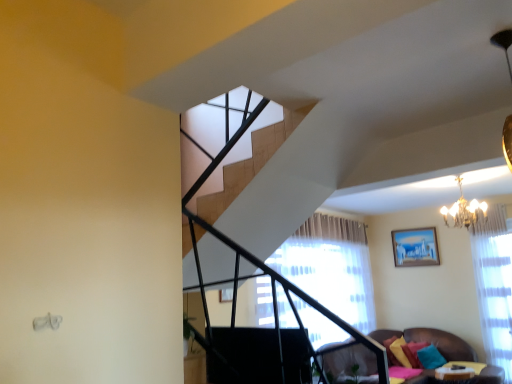
At what (x,y) coordinates should I click in order to perform the action: click on wooden table at lower right. Please return your answer as a coordinate pair (x, y). Image resolution: width=512 pixels, height=384 pixels. Looking at the image, I should click on (479, 373).

Identify the location of teal fabric pillow at lower right, which appears as the second pillow when viewed from the left. (411, 353).

What do you see at coordinates (400, 352) in the screenshot? The image size is (512, 384). I see `velvet yellow pillow at lower right, acting as the first pillow starting from the left` at bounding box center [400, 352].

Locate an element on the screen. This screenshot has height=384, width=512. matte blue painting at upper right is located at coordinates (415, 247).

Where is `wooden table at lower right`? The image size is (512, 384). wooden table at lower right is located at coordinates (x=479, y=373).

Is point (440, 355) behind point (393, 349)?

Yes, it is behind point (393, 349).

Which object is thinner, teal fabric pillow at lower right, which appears as the second pillow when viewed from the left, or velvet yellow pillow at lower right, which appears as the third pillow when viewed from the right?

With smaller width is teal fabric pillow at lower right, which appears as the second pillow when viewed from the left.

Identify the location of pillow that is the 2nd one when counting downward from the teal fabric pillow at lower right, the 2th pillow in the right-to-left sequence (from the image's perspective). (400, 352).

Which object is further away from the camera taking this photo, teal fabric pillow at lower right, the 2th pillow in the right-to-left sequence, or velvet yellow pillow at lower right, acting as the first pillow starting from the left?

velvet yellow pillow at lower right, acting as the first pillow starting from the left, is further from the camera.

Considering the sizes of objects teal fabric pillow at lower right, which is counted as the third pillow, starting from the left, and matte blue painting at upper right in the image provided, who is shorter, teal fabric pillow at lower right, which is counted as the third pillow, starting from the left, or matte blue painting at upper right?

teal fabric pillow at lower right, which is counted as the third pillow, starting from the left.

Can you tell me how much teal fabric pillow at lower right, arranged as the 1th pillow when viewed from the right, and matte blue painting at upper right differ in facing direction?

The facing directions of teal fabric pillow at lower right, arranged as the 1th pillow when viewed from the right, and matte blue painting at upper right are 61 degrees apart.

From a real-world perspective, which is physically below, teal fabric pillow at lower right, arranged as the 1th pillow when viewed from the right, or matte blue painting at upper right?

teal fabric pillow at lower right, arranged as the 1th pillow when viewed from the right, is physically lower.

From the picture: Is teal fabric pillow at lower right, arranged as the 1th pillow when viewed from the right, to the left or to the right of matte blue painting at upper right in the image?

In the image, teal fabric pillow at lower right, arranged as the 1th pillow when viewed from the right, appears on the left side of matte blue painting at upper right.

Is velvet brown couch at lower right positioned in front of gold crystal chandelier at upper right?

Yes, velvet brown couch at lower right is closer to the viewer.

From a real-world perspective, is velvet brown couch at lower right above or below gold crystal chandelier at upper right?

velvet brown couch at lower right is situated lower than gold crystal chandelier at upper right in the real world.

Considering the sizes of velvet brown couch at lower right and gold crystal chandelier at upper right in the image, is velvet brown couch at lower right bigger or smaller than gold crystal chandelier at upper right?

Considering their sizes, velvet brown couch at lower right takes up more space than gold crystal chandelier at upper right.

How many degrees apart are the facing directions of velvet brown couch at lower right and gold crystal chandelier at upper right?

90 degrees separate the facing orientations of velvet brown couch at lower right and gold crystal chandelier at upper right.

Are teal fabric pillow at lower right, arranged as the 1th pillow when viewed from the right, and wooden table at lower right far apart?

teal fabric pillow at lower right, arranged as the 1th pillow when viewed from the right, is near wooden table at lower right, not far away.

From a real-world perspective, is teal fabric pillow at lower right, arranged as the 1th pillow when viewed from the right, located beneath wooden table at lower right?

No.

Considering the sizes of objects teal fabric pillow at lower right, which is counted as the third pillow, starting from the left, and wooden table at lower right in the image provided, who is taller, teal fabric pillow at lower right, which is counted as the third pillow, starting from the left, or wooden table at lower right?

Standing taller between the two is teal fabric pillow at lower right, which is counted as the third pillow, starting from the left.

Considering the relative sizes of teal fabric pillow at lower right, arranged as the 1th pillow when viewed from the right, and wooden table at lower right in the image provided, is teal fabric pillow at lower right, arranged as the 1th pillow when viewed from the right, smaller than wooden table at lower right?

Correct, teal fabric pillow at lower right, arranged as the 1th pillow when viewed from the right, occupies less space than wooden table at lower right.

Which of these two, velvet yellow pillow at lower right, acting as the first pillow starting from the left, or teal fabric pillow at lower right, which appears as the second pillow when viewed from the left, is thinner?

With smaller width is teal fabric pillow at lower right, which appears as the second pillow when viewed from the left.

Can you confirm if velvet yellow pillow at lower right, which appears as the third pillow when viewed from the right, is taller than teal fabric pillow at lower right, which appears as the second pillow when viewed from the left?

Yes, velvet yellow pillow at lower right, which appears as the third pillow when viewed from the right, is taller than teal fabric pillow at lower right, which appears as the second pillow when viewed from the left.

Which pillow is the 1st one when counting from the right side of the velvet yellow pillow at lower right, acting as the first pillow starting from the left? Please provide its 2D coordinates.

[(411, 353)]

Measure the distance from teal fabric pillow at lower right, arranged as the 1th pillow when viewed from the right, to velvet brown couch at lower right.

teal fabric pillow at lower right, arranged as the 1th pillow when viewed from the right, is 3.59 meters from velvet brown couch at lower right.

From a real-world perspective, is teal fabric pillow at lower right, which is counted as the third pillow, starting from the left, positioned over velvet brown couch at lower right based on gravity?

No, from a real-world perspective, teal fabric pillow at lower right, which is counted as the third pillow, starting from the left, is not above velvet brown couch at lower right.

Is teal fabric pillow at lower right, arranged as the 1th pillow when viewed from the right, spatially inside velvet brown couch at lower right, or outside of it?

teal fabric pillow at lower right, arranged as the 1th pillow when viewed from the right, cannot be found inside velvet brown couch at lower right.

Is teal fabric pillow at lower right, arranged as the 1th pillow when viewed from the right, aimed at velvet brown couch at lower right?

No, teal fabric pillow at lower right, arranged as the 1th pillow when viewed from the right, is not oriented towards velvet brown couch at lower right.

Would you say gold crystal chandelier at upper right is inside or outside velvet brown couch at lower right?

gold crystal chandelier at upper right is located beyond the bounds of velvet brown couch at lower right.

Is gold crystal chandelier at upper right far away from velvet brown couch at lower right?

Yes, gold crystal chandelier at upper right and velvet brown couch at lower right are quite far apart.

From the image's perspective, between gold crystal chandelier at upper right and velvet brown couch at lower right, who is located below?

velvet brown couch at lower right is shown below in the image.

This screenshot has width=512, height=384. Identify the location of the 2nd pillow below when counting from the teal fabric pillow at lower right, which appears as the second pillow when viewed from the left (from the image's perspective). 400,352.

Image resolution: width=512 pixels, height=384 pixels. I want to click on the 3rd pillow in front of the matte blue painting at upper right, starting your count from the anchor, so click(x=430, y=357).

Which object lies further to the anchor point wooden table at lower right, matte blue painting at upper right or velvet brown couch at lower right?

velvet brown couch at lower right is positioned further to the anchor wooden table at lower right.

Based on their spatial positions, is matte blue painting at upper right or gold crystal chandelier at upper right further from teal fabric pillow at lower right, which appears as the second pillow when viewed from the left?

The object further to teal fabric pillow at lower right, which appears as the second pillow when viewed from the left, is gold crystal chandelier at upper right.

Which object lies nearer to the anchor point teal fabric pillow at lower right, which is counted as the third pillow, starting from the left, matte blue painting at upper right or teal fabric pillow at lower right, which appears as the second pillow when viewed from the left?

teal fabric pillow at lower right, which appears as the second pillow when viewed from the left, lies closer to teal fabric pillow at lower right, which is counted as the third pillow, starting from the left, than the other object.

Based on their spatial positions, is velvet yellow pillow at lower right, acting as the first pillow starting from the left, or teal fabric pillow at lower right, which is counted as the third pillow, starting from the left, closer to velvet brown couch at lower right?

velvet yellow pillow at lower right, acting as the first pillow starting from the left.

Which object lies further to the anchor point velvet yellow pillow at lower right, acting as the first pillow starting from the left, wooden table at lower right or gold crystal chandelier at upper right?

gold crystal chandelier at upper right is further to velvet yellow pillow at lower right, acting as the first pillow starting from the left.

When comparing their distances from velvet brown couch at lower right, does teal fabric pillow at lower right, the 2th pillow in the right-to-left sequence, or wooden table at lower right seem further?

wooden table at lower right.

Which object lies nearer to the anchor point gold crystal chandelier at upper right, velvet brown couch at lower right or teal fabric pillow at lower right, the 2th pillow in the right-to-left sequence?

teal fabric pillow at lower right, the 2th pillow in the right-to-left sequence, is closer to gold crystal chandelier at upper right.

Based on their spatial positions, is matte blue painting at upper right or teal fabric pillow at lower right, arranged as the 1th pillow when viewed from the right, further from gold crystal chandelier at upper right?

teal fabric pillow at lower right, arranged as the 1th pillow when viewed from the right.

I want to click on table located between gold crystal chandelier at upper right and matte blue painting at upper right in the depth direction, so click(x=479, y=373).

Where is `table positioned between velvet brown couch at lower right and teal fabric pillow at lower right, arranged as the 1th pillow when viewed from the right, from near to far`? This screenshot has width=512, height=384. table positioned between velvet brown couch at lower right and teal fabric pillow at lower right, arranged as the 1th pillow when viewed from the right, from near to far is located at coordinates (479, 373).

In order to click on light fixture between velvet brown couch at lower right and matte blue painting at upper right in the front-back direction in this screenshot , I will do `click(464, 210)`.

Identify the location of table between gold crystal chandelier at upper right and teal fabric pillow at lower right, which appears as the second pillow when viewed from the left, in the vertical direction. (479, 373).